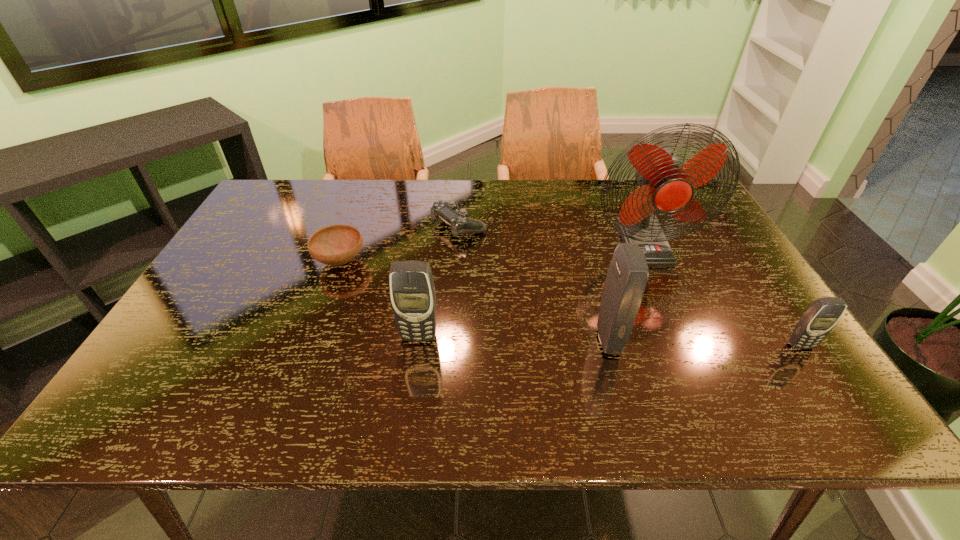
Find the location of `the second tallest cellular telephone`. the second tallest cellular telephone is located at coordinates (412, 291).

Locate an element on the screen. The image size is (960, 540). the leftmost cellular telephone is located at coordinates (412, 291).

You are a GUI agent. You are given a task and a screenshot of the screen. Output one action in this format:
    pyautogui.click(x=<x>, y=<y>)
    Task: Click on the second cellular telephone from left to right
    Image resolution: width=960 pixels, height=540 pixels.
    Given the screenshot: What is the action you would take?
    pyautogui.click(x=626, y=279)

You are a GUI agent. You are given a task and a screenshot of the screen. Output one action in this format:
    pyautogui.click(x=<x>, y=<y>)
    Task: Click on the rightmost cellular telephone
    
    Given the screenshot: What is the action you would take?
    (x=819, y=319)

Image resolution: width=960 pixels, height=540 pixels. Find the location of `the shortest cellular telephone`. the shortest cellular telephone is located at coordinates (819, 319).

Find the location of a particular element. control is located at coordinates (449, 211).

Locate an element on the screen. This screenshot has width=960, height=540. the tallest object is located at coordinates (666, 186).

Where is `the leftmost object`? the leftmost object is located at coordinates (334, 245).

Locate an element on the screen. The width and height of the screenshot is (960, 540). vacant position located on the front face of the leftmost cellular telephone is located at coordinates (413, 381).

Where is `vacant region located on the front face of the second cellular telephone from right to left`? vacant region located on the front face of the second cellular telephone from right to left is located at coordinates (753, 341).